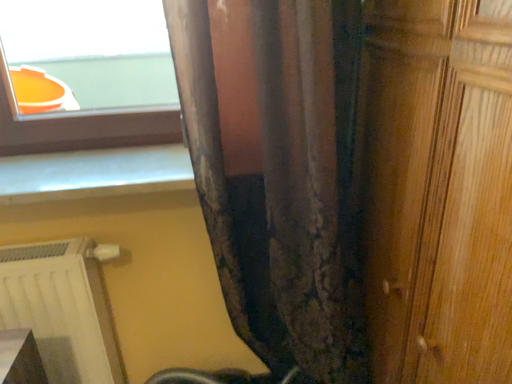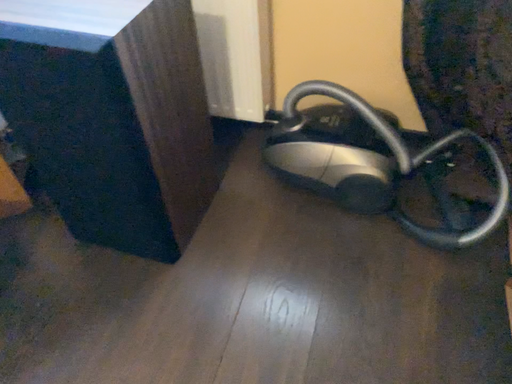
Question: Which way did the camera rotate in the video?

Choices:
 (A) rotated downward
 (B) rotated upward

Answer: (A)